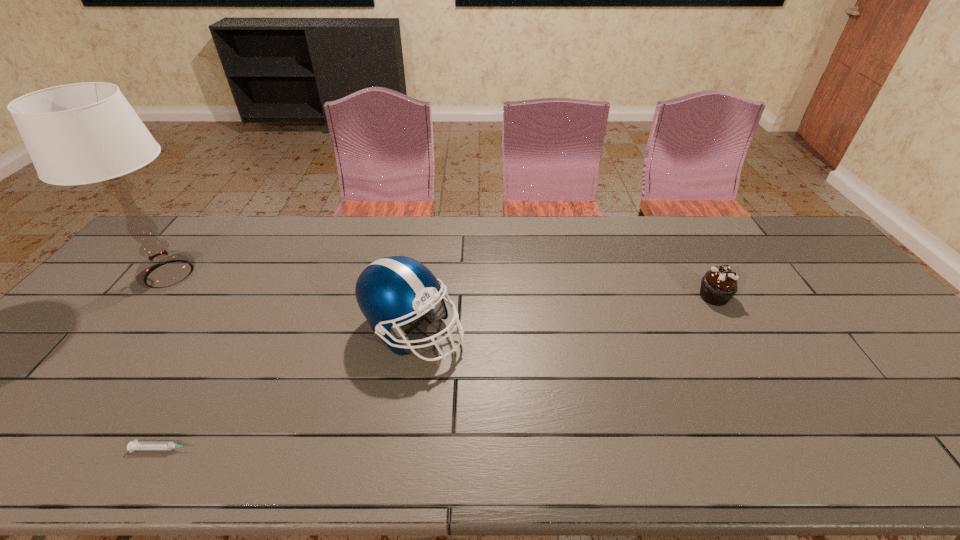
I want to click on free spot between the syringe and the tallest object, so click(x=166, y=361).

The image size is (960, 540). What are the coordinates of `vacant point located between the second object from left to right and the second shortest object` in the screenshot? It's located at (439, 373).

Image resolution: width=960 pixels, height=540 pixels. What are the coordinates of `free space between the football helmet and the cupcake` in the screenshot? It's located at (564, 314).

This screenshot has height=540, width=960. In order to click on blank region between the second shortest object and the football helmet in this screenshot , I will do pos(564,314).

Where is `vacant area between the syringe and the rightmost object`? The image size is (960, 540). vacant area between the syringe and the rightmost object is located at coordinates (439, 373).

You are a GUI agent. You are given a task and a screenshot of the screen. Output one action in this format:
    pyautogui.click(x=<x>, y=<y>)
    Task: Click on the free area in between the football helmet and the third tallest object
    The width and height of the screenshot is (960, 540).
    Given the screenshot: What is the action you would take?
    pyautogui.click(x=564, y=314)

You are a GUI agent. You are given a task and a screenshot of the screen. Output one action in this format:
    pyautogui.click(x=<x>, y=<y>)
    Task: Click on the third closest object to the leftmost object
    
    Given the screenshot: What is the action you would take?
    pyautogui.click(x=719, y=284)

Locate which object ranks in proximity to the table lamp. Please provide its 2D coordinates. Your answer should be formatted as a tuple, i.e. [(x, y)], where the tuple contains the x and y coordinates of a point satisfying the conditions above.

[(135, 445)]

Where is `free space that satisfies the following two spatial constraints: 1. on the front-facing side of the rightmost object; 2. on the right side of the leftmost object`? This screenshot has width=960, height=540. free space that satisfies the following two spatial constraints: 1. on the front-facing side of the rightmost object; 2. on the right side of the leftmost object is located at coordinates (151, 296).

Where is `free space that satisfies the following two spatial constraints: 1. on the front side of the cupcake; 2. at the needle end of the syringe`? free space that satisfies the following two spatial constraints: 1. on the front side of the cupcake; 2. at the needle end of the syringe is located at coordinates (802, 448).